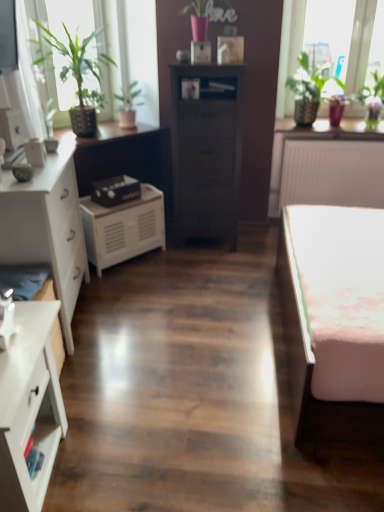
This screenshot has width=384, height=512. Find the location of `empty space that is to the right of white matte cabinet at center`. empty space that is to the right of white matte cabinet at center is located at coordinates (168, 258).